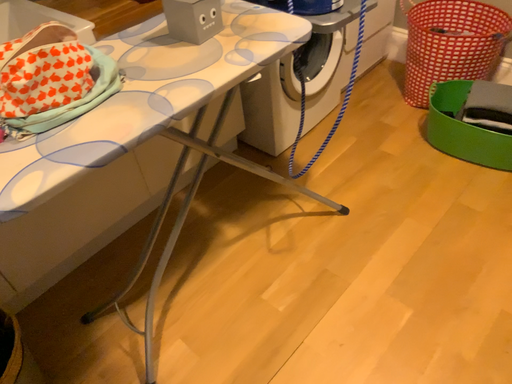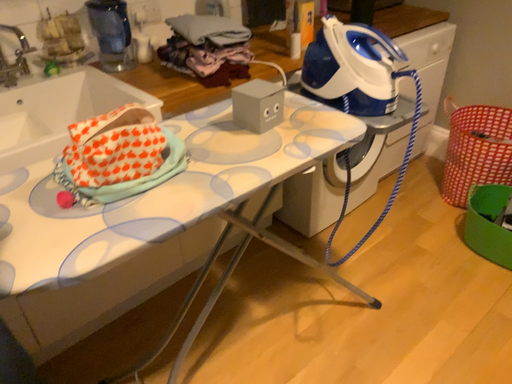
Question: Which way did the camera rotate in the video?

Choices:
 (A) rotated downward
 (B) rotated upward

Answer: (B)